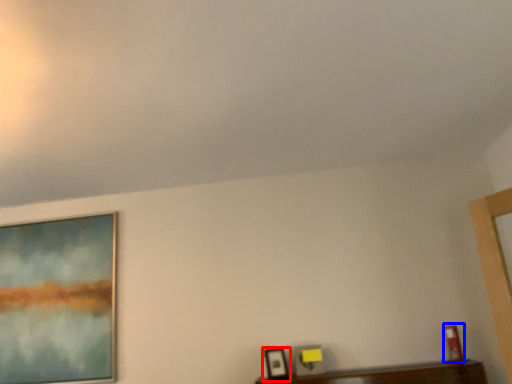
Question: Which of the following is the farthest to the observer, picture frame (highlighted by a red box) or picture frame (highlighted by a blue box)?

Choices:
 (A) picture frame
 (B) picture frame

Answer: (A)